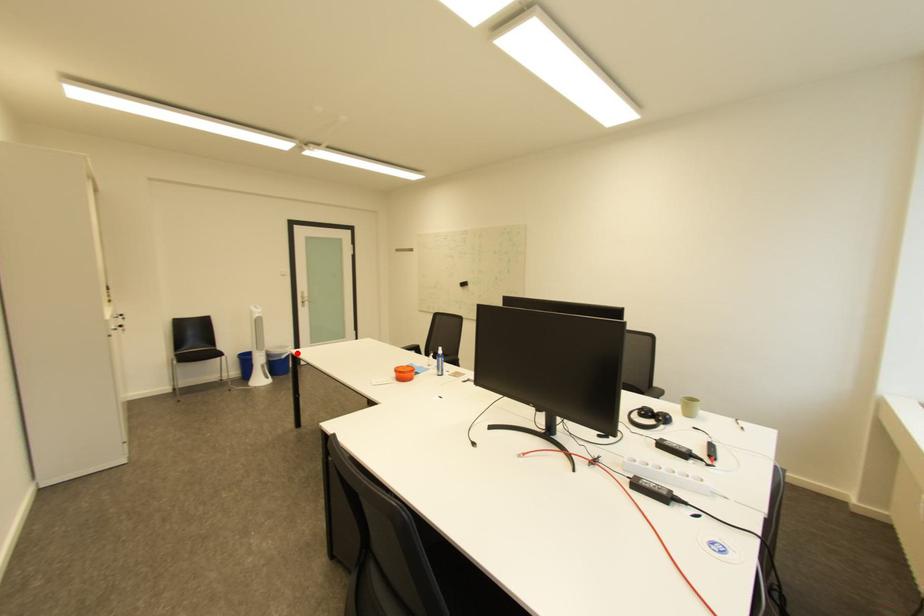
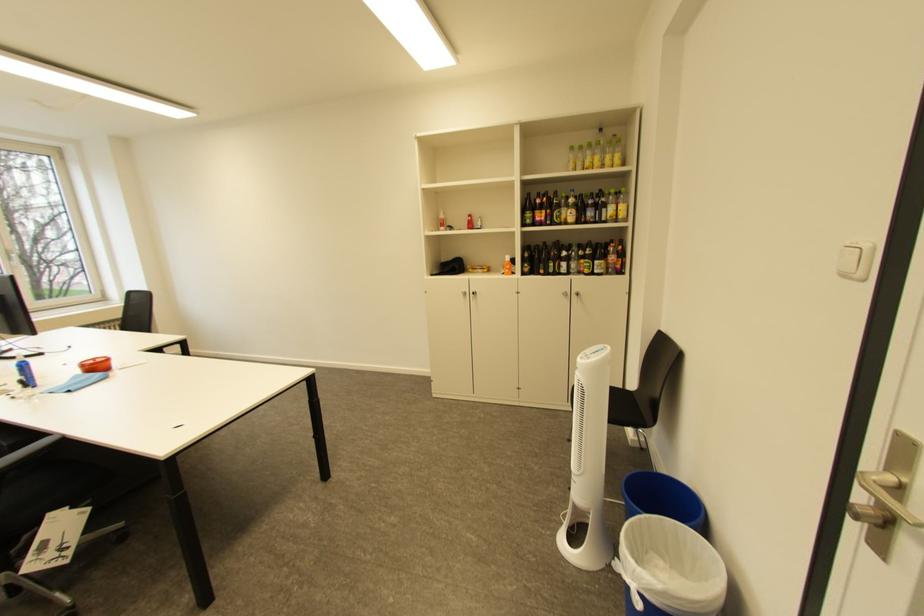
Question: I am providing you with two images of the same scene from different viewpoints. Given a red point in image1, look at the same physical point in image2. Is it:

Choices:
 (A) Closer to the viewpoint
 (B) Farther from the viewpoint

Answer: (A)